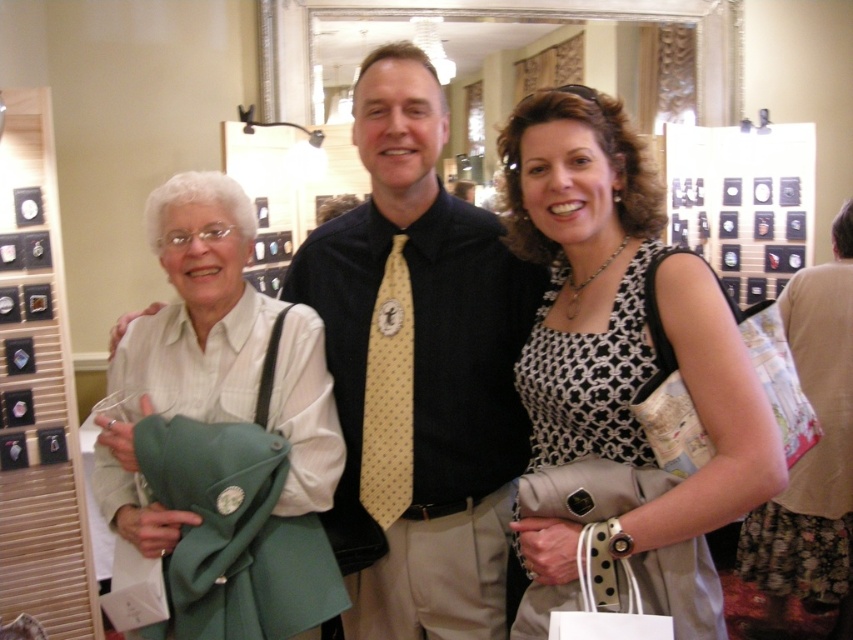
You are standing in the room and want to reach both the point at the coordinates (358, 440) and the point at (691, 294). Which point should you head towards first if you want to reach the closer one first?

You should head towards point (358, 440) first because it is closer to you than point (691, 294).

You are a photographer positioned in front of the group. You notice the white cotton shirt at center and the beige dotted tie at center. Which one would appear larger in your camera viewfinder?

The white cotton shirt at center appears larger in the camera viewfinder because it is closer to the viewer than the beige dotted tie at center.

Consider the image. You are attending an event and notice two individuals wearing ties. The first has a yellow dotted tie at center and the second has a beige dotted tie at center. From your perspective, which tie appears higher in the image?

The yellow dotted tie at center appears higher in the image as it is located above the beige dotted tie at center.